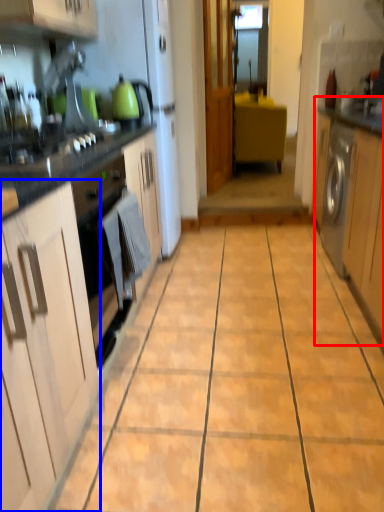
Question: Which object is closer to the camera taking this photo, cabinetry (highlighted by a red box) or cabinetry (highlighted by a blue box)?

Choices:
 (A) cabinetry
 (B) cabinetry

Answer: (B)